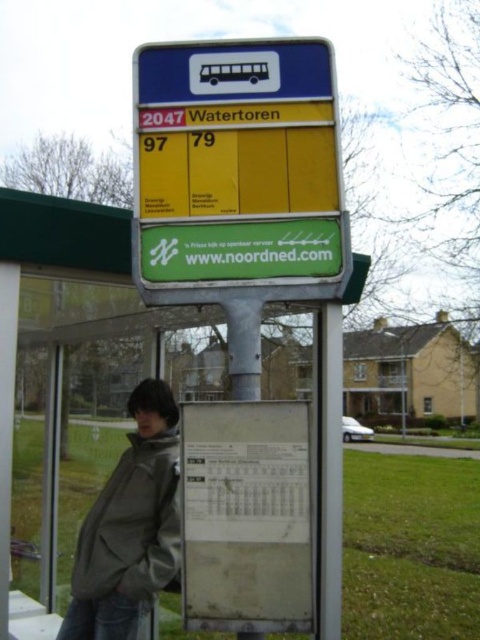
Question: Which of the following is the farthest from the observer?

Choices:
 (A) metallic green sign at center
 (B) gray matte jacket at lower left

Answer: (B)

Question: Does metallic green sign at center have a smaller size compared to gray matte jacket at lower left?

Choices:
 (A) no
 (B) yes

Answer: (A)

Question: Does metallic green sign at center have a larger size compared to gray matte jacket at lower left?

Choices:
 (A) no
 (B) yes

Answer: (B)

Question: Where is metallic green sign at center located in relation to gray matte jacket at lower left in the image?

Choices:
 (A) right
 (B) left

Answer: (B)